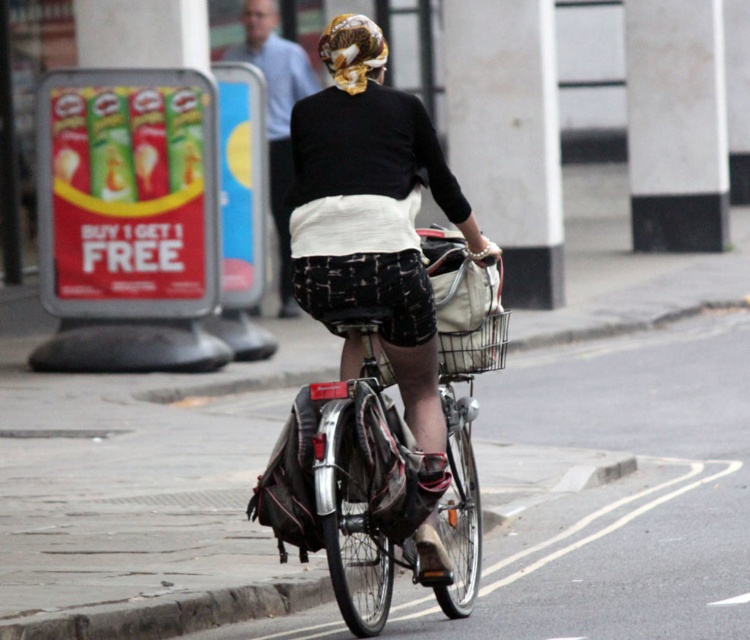
You are a delivery person who needs to deliver a package to a location marked by the point at coordinates point (x=424, y=348) and point (x=362, y=45). Which point should you reach first according to the image?

Point (x=424, y=348) is in front of point (x=362, y=45), so you should reach point (x=424, y=348) first.

You are a delivery person who needs to place a package on the bicycle. The package must be placed at either point A or point B on the bicycle. Point A is located at point (x=360, y=216) and point B is at point (x=484, y=339). Which point is closer to you, the delivery person, when you are standing in front of the bicycle?

Point A at point (x=360, y=216) is closer to the viewer than point B at point (x=484, y=339), so you should place the package there.